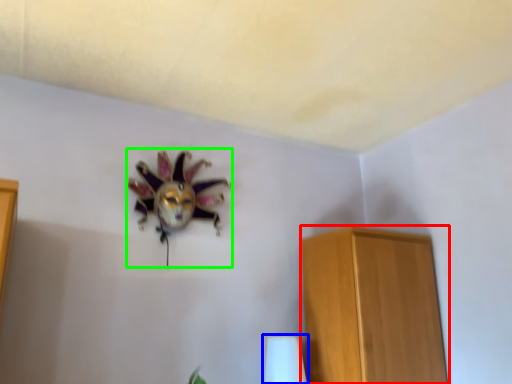
Question: Considering the real-world distances, which object is farthest from furniture (highlighted by a red box)? table lamp (highlighted by a blue box) or animal (highlighted by a green box)?

Choices:
 (A) table lamp
 (B) animal

Answer: (B)